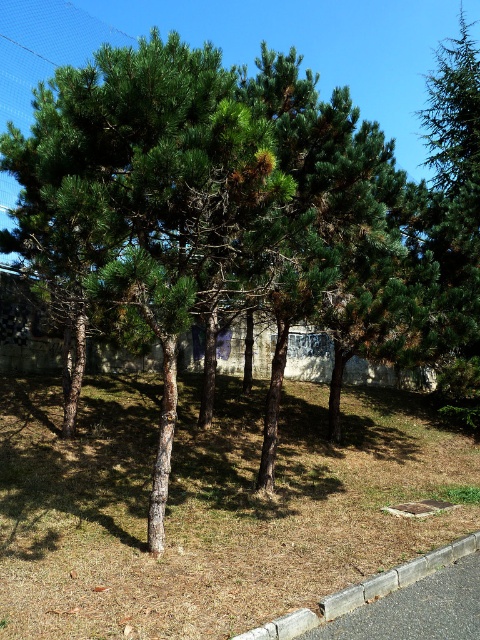
Does point (177, 474) come in front of point (264, 632)?

No.

This screenshot has height=640, width=480. What do you see at coordinates (211, 506) in the screenshot?
I see `brown dry grass at center` at bounding box center [211, 506].

Which is behind, point (348, 566) or point (477, 534)?

Positioned behind is point (477, 534).

Where is `brown dry grass at center`? brown dry grass at center is located at coordinates (211, 506).

Which is more to the right, brown dry grass at center or green needle-like at upper right?

Positioned to the right is green needle-like at upper right.

Does point (116, 413) lie behind point (474, 125)?

That is False.

What do you see at coordinates (211, 506) in the screenshot?
I see `brown dry grass at center` at bounding box center [211, 506].

Locate an element on the screen. The image size is (480, 640). brown dry grass at center is located at coordinates (211, 506).

Where is `green needle-like at upper right`? The height and width of the screenshot is (640, 480). green needle-like at upper right is located at coordinates (456, 220).

Who is positioned more to the right, green needle-like at upper right or gray concrete curb at lower right?

Positioned to the right is green needle-like at upper right.

Describe the element at coordinates (456, 220) in the screenshot. I see `green needle-like at upper right` at that location.

At what (x,y) coordinates should I click in order to perform the action: click on green needle-like at upper right. Please return your answer as a coordinate pair (x, y). The height and width of the screenshot is (640, 480). Looking at the image, I should click on (456, 220).